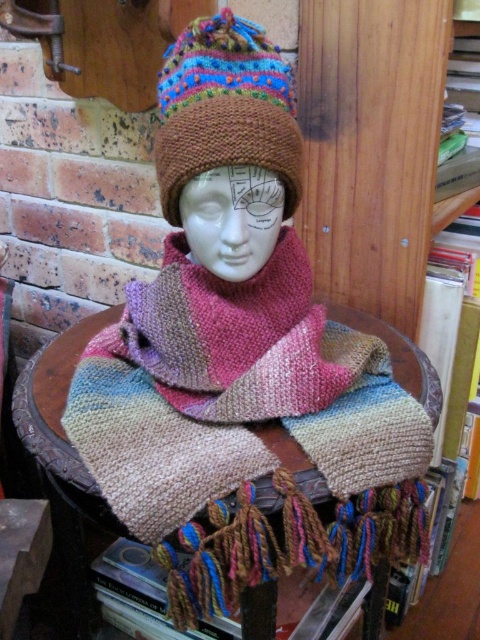
You are a tailor trying to determine which item takes up more space horizontally in the image. Based on the scene, which one has a greater width between the knitted woolen hat at center and the knitted fabric at center?

The knitted fabric at center has a greater width than the knitted woolen hat at center.

You are an interior designer arranging a display for a knitwear store. You have a knitted woolen hat at center and a knitted fabric at center. Based on their positions, which item should you adjust to ensure the scarf is visible? Explain your reasoning.

The knitted woolen hat at center is located above the knitted fabric at center. To ensure the scarf is visible, you should adjust the knitted woolen hat at center so it is moved downward or the knitted fabric at center is moved upward, allowing the scarf to be seen without obstruction.

You are a photographer setting up a shot of the mannequin head with the knitted woolen hat at center. You need to ensure the hat is in focus. If your camera has a depth of field that can sharply focus objects within 25 inches of the lens, will the hat be in focus?

The knitted woolen hat at center is 25.28 inches away from the camera. Since the depth of field can focus within 25 inches, the hat is slightly beyond the optimal range, so it may not be in perfect focus. Adjust the focus or move closer for clarity.